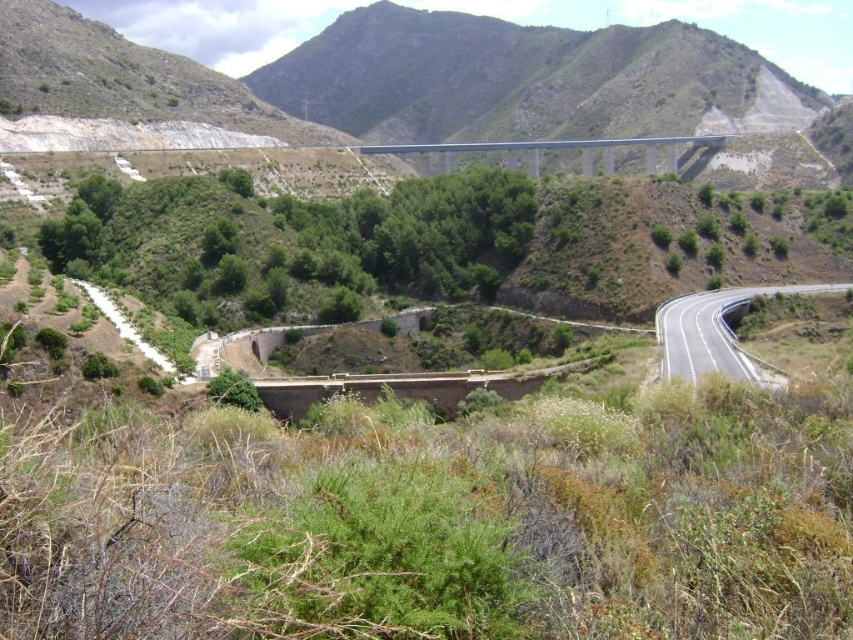
Is asphalt road at center wider than blue concrete bridge at center?

No.

From the picture: Who is more distant from viewer, (701,324) or (614,140)?

The point (614,140) is more distant.

The image size is (853, 640). I want to click on asphalt road at center, so click(717, 333).